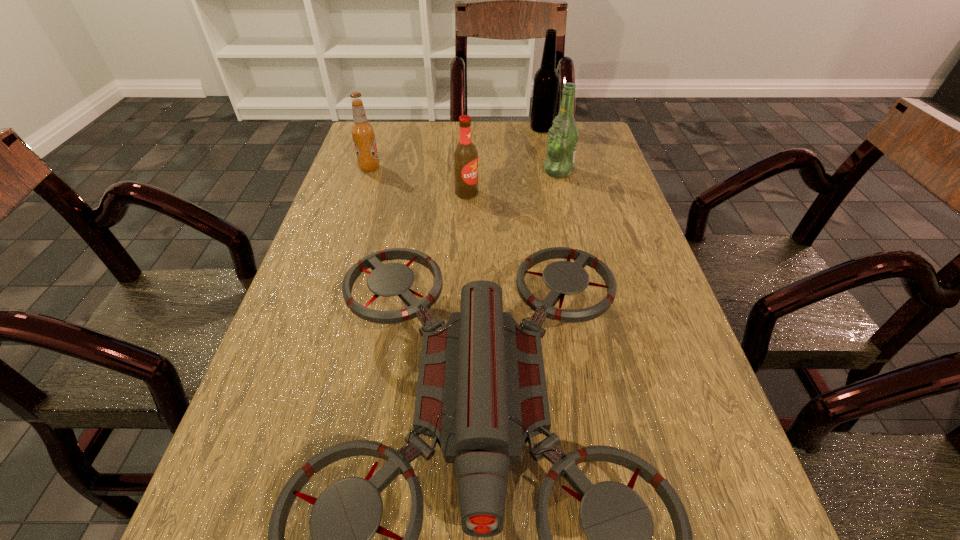
Locate an element on the screen. Image resolution: width=960 pixels, height=540 pixels. object that is positioned at the far right corner is located at coordinates (546, 80).

Image resolution: width=960 pixels, height=540 pixels. In the image, there is a desktop. In order to click on vacant space at the far edge in this screenshot , I will do `click(449, 126)`.

Find the location of a particular element. free spot at the left edge of the desktop is located at coordinates (240, 495).

In the image, there is a desktop. Where is `vacant region at the right edge`? This screenshot has width=960, height=540. vacant region at the right edge is located at coordinates (632, 276).

Where is `free spot between the leftmost beer bottle and the tallest object`? free spot between the leftmost beer bottle and the tallest object is located at coordinates (456, 148).

Identify the location of free space between the farthest beer bottle and the leftmost beer bottle. (456, 148).

You are a GUI agent. You are given a task and a screenshot of the screen. Output one action in this format:
    pyautogui.click(x=<x>, y=<y>)
    Task: Click on the free space that is in between the nearest beer bottle and the leftmost beer bottle
    This screenshot has width=960, height=540.
    Given the screenshot: What is the action you would take?
    pyautogui.click(x=419, y=180)

At what (x,y) coordinates should I click in order to perform the action: click on free space between the leftmost object and the tallest object. Please return your answer as a coordinate pair (x, y). Looking at the image, I should click on (456, 148).

Locate an element on the screen. The width and height of the screenshot is (960, 540). the third closest object to the fourth farthest object is located at coordinates (481, 394).

This screenshot has width=960, height=540. I want to click on the fourth closest object relative to the second beer bottle from left to right, so click(x=546, y=80).